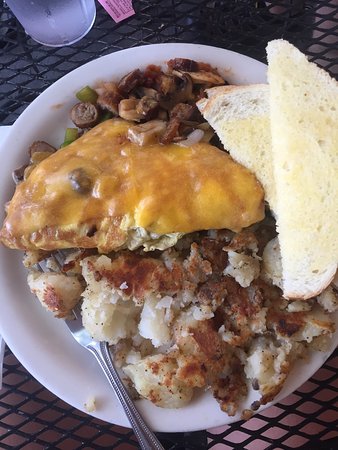
At what (x,y) coordinates should I click in order to perform the action: click on plate. Please return your answer as a coordinate pair (x, y). Looking at the image, I should click on pos(39,334).